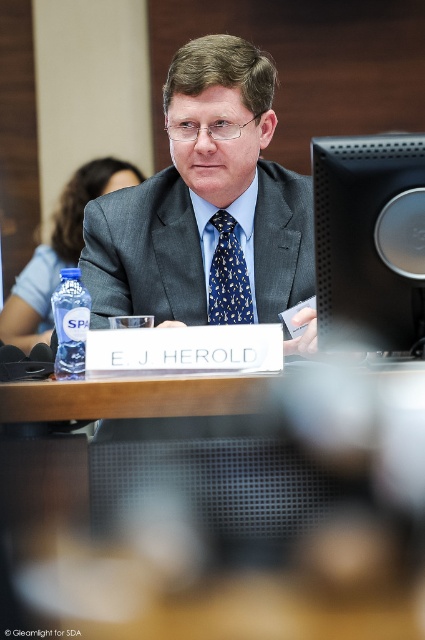
You are organizing a presentation and need to place a 12 inch wide laptop between the black matte monitor at upper right and the blue printed silk tie at center. Can the laptop fit horizontally between them?

The black matte monitor at upper right is wider than the blue printed silk tie at center. Since the laptop is 12 inches wide, it might not fit if the space between them is narrower than 12 inches. However, without knowing the exact distance between the two objects, we cannot definitively determine if the laptop will fit.